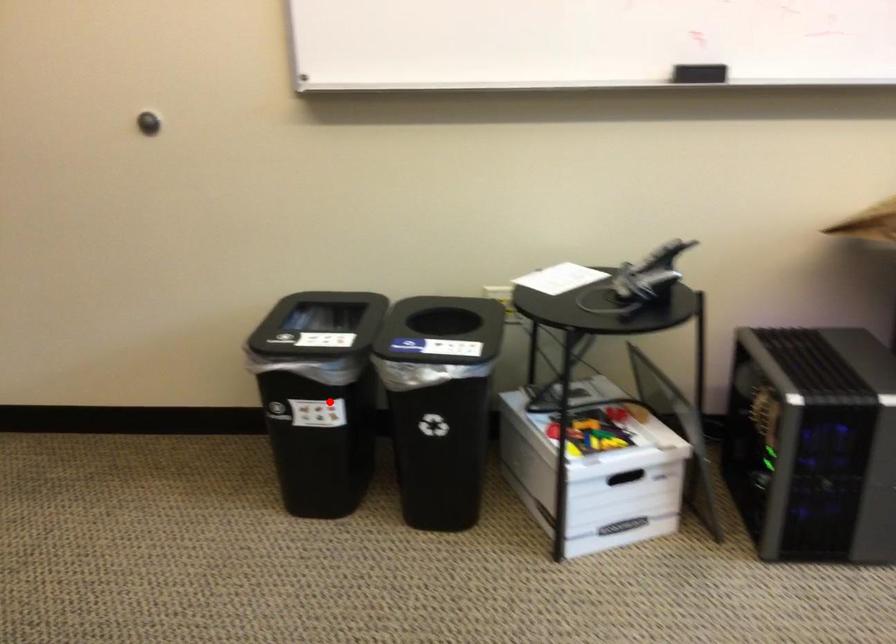
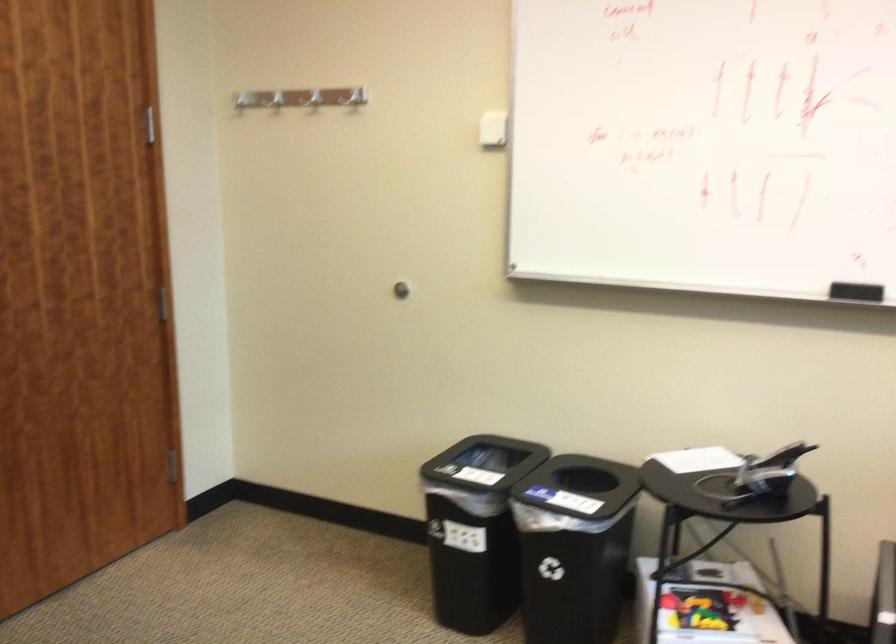
Where in the second image is the point corresponding to the highlighted location from the first image?

(475, 529)